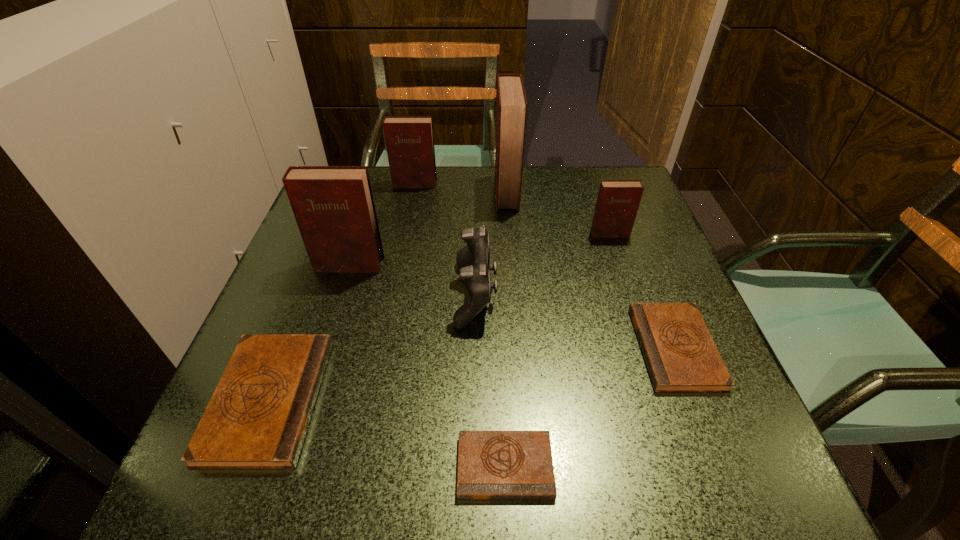
Point out which brown diary is positioned as the second nearest to the control. Please provide its 2D coordinates. Your answer should be formatted as a tuple, i.e. [(x, y)], where the tuple contains the x and y coordinates of a point satisfying the conditions above.

[(257, 418)]

This screenshot has height=540, width=960. I want to click on the closest brown diary relative to the tallest diary, so click(680, 354).

In order to click on vacant space that satisfies the following two spatial constraints: 1. on the spine side of the rightmost brown diary; 2. on the spine side of the shortest object in this screenshot , I will do `click(721, 466)`.

The height and width of the screenshot is (540, 960). Identify the location of blank area in the image that satisfies the following two spatial constraints: 1. on the spine side of the second smallest brown diary; 2. on the spine side of the second brown diary from left to right. (721, 466).

Identify the location of vacant space that satisfies the following two spatial constraints: 1. on the front cover of the third smallest reddish-brown diary; 2. on the spine side of the third shortest diary. (307, 399).

The height and width of the screenshot is (540, 960). In order to click on vacant space that satisfies the following two spatial constraints: 1. on the front cover of the fourth farthest diary; 2. on the spine side of the biggest brown diary in this screenshot , I will do `click(307, 399)`.

This screenshot has height=540, width=960. Find the location of `vacant position in the image that satisfies the following two spatial constraints: 1. on the spine side of the sixth tallest diary; 2. on the spine side of the smallest brown diary`. vacant position in the image that satisfies the following two spatial constraints: 1. on the spine side of the sixth tallest diary; 2. on the spine side of the smallest brown diary is located at coordinates (721, 466).